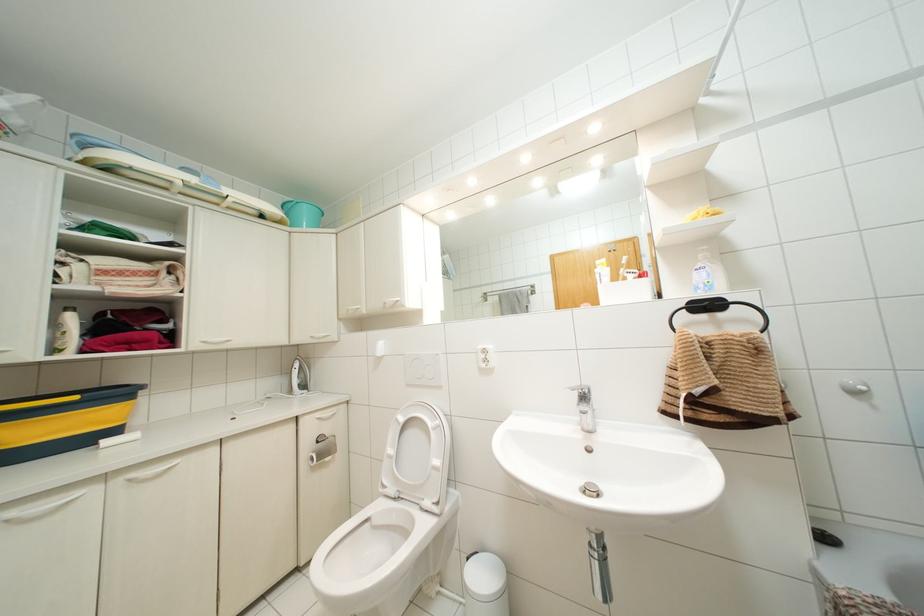
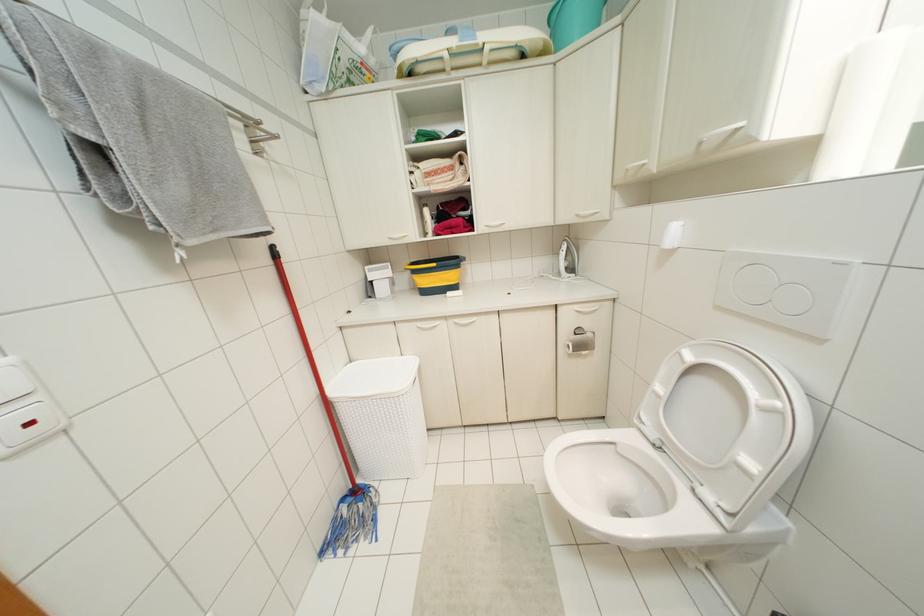
Where in the second image is the point corresponding to point (132, 475) from the first image?

(456, 320)